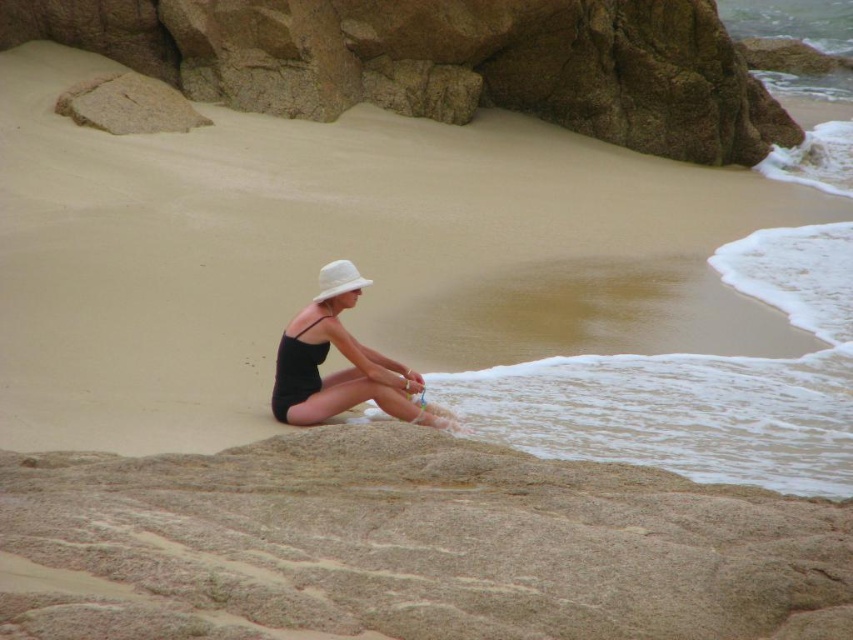
Question: Which object appears closest to the camera in this image?

Choices:
 (A) smooth beige sand at lower center
 (B) white matte hat at center
 (C) matte black swimsuit at center

Answer: (A)

Question: Where is matte black swimsuit at center located in relation to white matte hat at center in the image?

Choices:
 (A) below
 (B) above

Answer: (A)

Question: Does smooth beige sand at lower center appear under matte black swimsuit at center?

Choices:
 (A) no
 (B) yes

Answer: (B)

Question: Which point is farther to the camera?

Choices:
 (A) smooth beige sand at lower center
 (B) white matte hat at center

Answer: (B)

Question: Can you confirm if smooth beige sand at lower center is wider than white matte hat at center?

Choices:
 (A) yes
 (B) no

Answer: (A)

Question: Among these objects, which one is nearest to the camera?

Choices:
 (A) matte black swimsuit at center
 (B) white matte hat at center
 (C) smooth beige sand at lower center

Answer: (C)